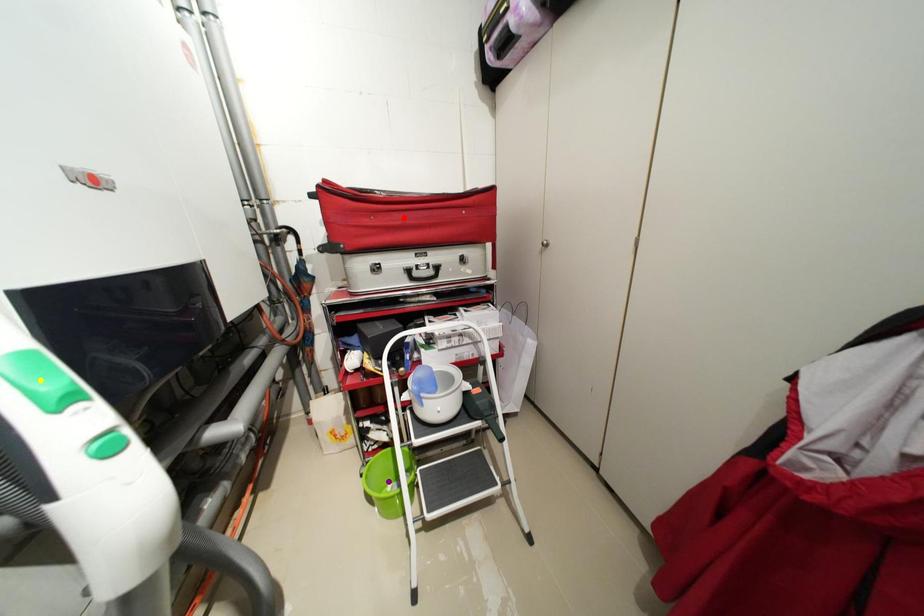
Order these from nearest to farthest:
red point, yellow point, purple point

yellow point
red point
purple point